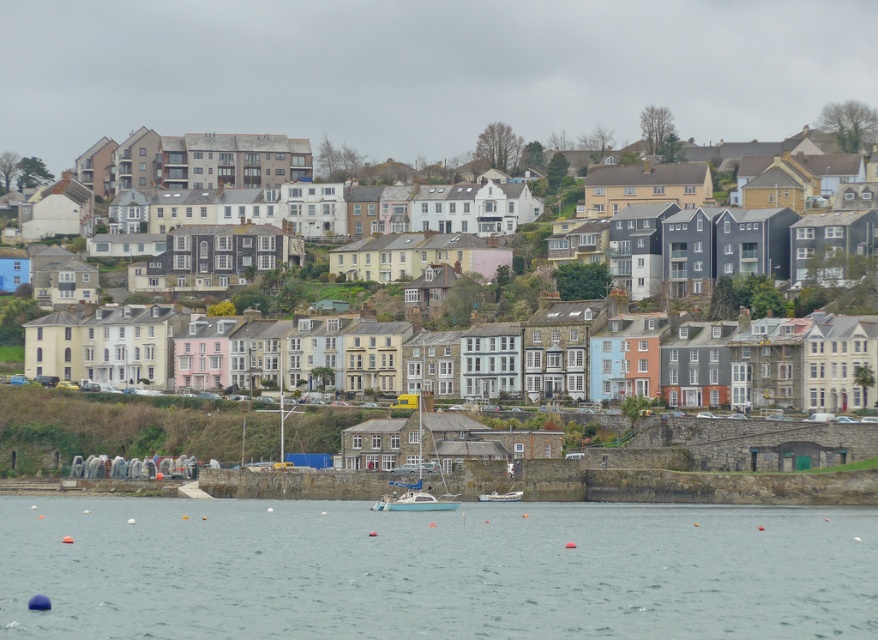
You are standing at the shore of the coastal town and looking out at the water. There are two points marked in the scene. Which of the two points, point (x=398, y=499) or point (x=501, y=497), is closer to you?

Point (x=398, y=499) is closer to you than point (x=501, y=497).

You are a small toy boat that is 1 meter long. You want to sail from the clear water at lower center to the light blue plastic boat at center. Can you fit through the space between them?

The clear water at lower center might be wider than light blue plastic boat at center, so there is a possibility that the space between them is sufficient for the toy boat to pass through. However, since the exact width isn not specified, it is uncertain. Please check the actual distance before proceeding.

You are a tour guide explaining the coastal town to visitors. You point out the clear water at lower center and the white plastic boat at center. How far apart are these two landmarks?

The clear water at lower center is 31.65 meters away from the white plastic boat at center.